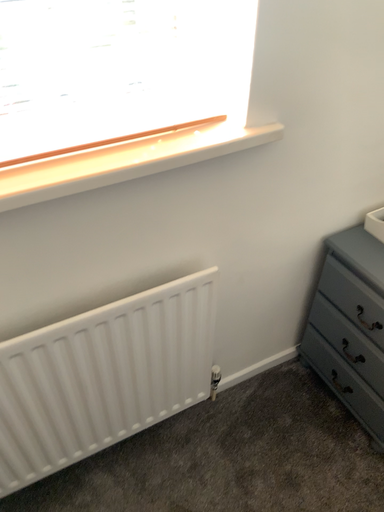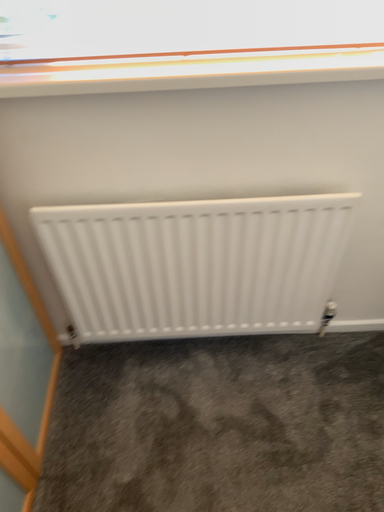
Question: Which way did the camera rotate in the video?

Choices:
 (A) rotated right
 (B) rotated left

Answer: (B)